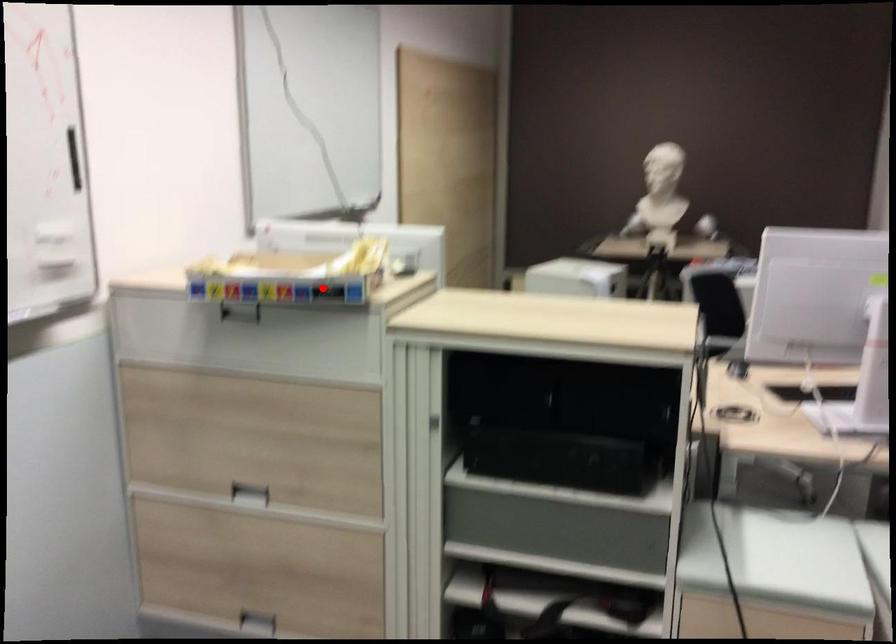
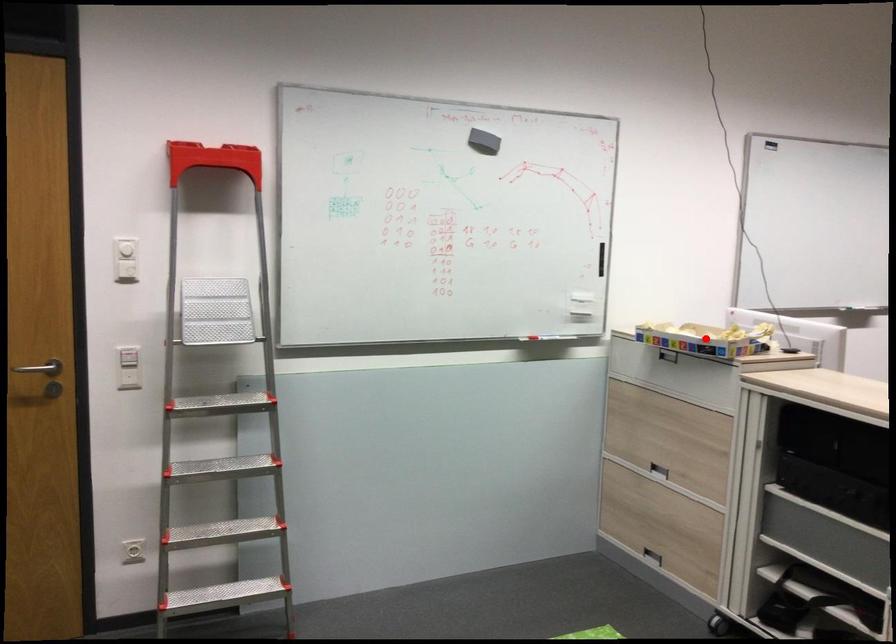
I am providing you with two images of the same scene from different viewpoints. A red point is marked on the first image and another point is marked on the second image. Is the red point in image1 aligned with the point shown in image2?

Yes